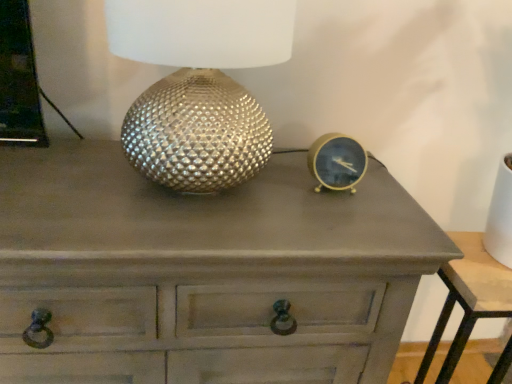
Locate an element on the screen. vacant space in front of metallic textured lamp at center is located at coordinates (160, 242).